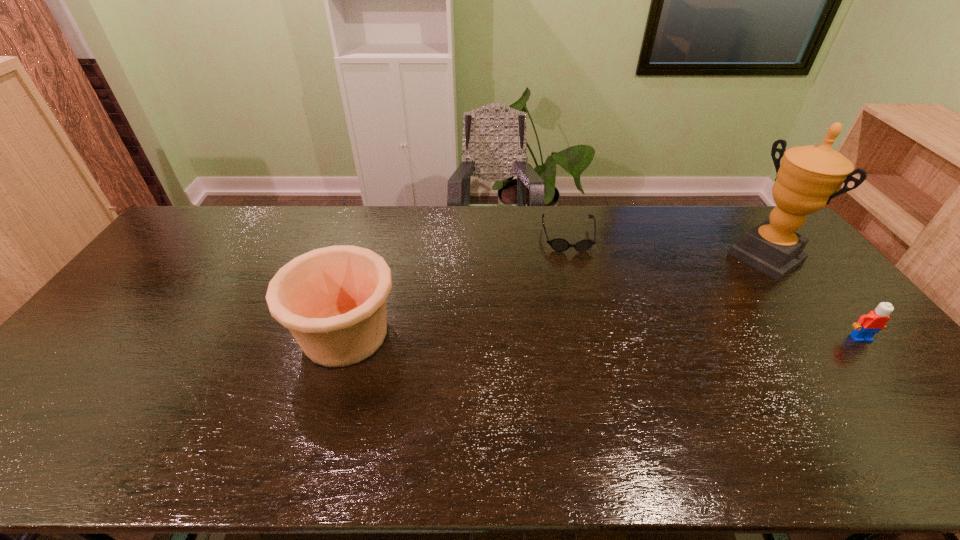
In the image, there is a desktop. Identify the location of vacant space at the near edge. This screenshot has height=540, width=960. (584, 406).

Find the location of `vacant point at the far left corner`. vacant point at the far left corner is located at coordinates (210, 229).

This screenshot has height=540, width=960. Identify the location of free space between the pottery and the tallest object. (556, 296).

Find the location of a particular element. This screenshot has height=540, width=960. blank region between the tallest object and the leftmost object is located at coordinates tap(556, 296).

At what (x,y) coordinates should I click in order to perform the action: click on vacant area that lies between the tallest object and the pottery. Please return your answer as a coordinate pair (x, y). This screenshot has height=540, width=960. Looking at the image, I should click on coord(556,296).

The image size is (960, 540). Find the location of `free space between the pottery and the sunglasses`. free space between the pottery and the sunglasses is located at coordinates pos(457,286).

I want to click on vacant space that's between the pottery and the tallest object, so click(556, 296).

Locate an element on the screen. The image size is (960, 540). free point between the second object from left to right and the third tallest object is located at coordinates (714, 288).

You are a GUI agent. You are given a task and a screenshot of the screen. Output one action in this format:
    pyautogui.click(x=<x>, y=<y>)
    Task: Click on the free spot between the third shortest object and the Lego
    
    Given the screenshot: What is the action you would take?
    pyautogui.click(x=603, y=336)

The height and width of the screenshot is (540, 960). Identify the location of unoccupied position between the third tallest object and the award. (813, 298).